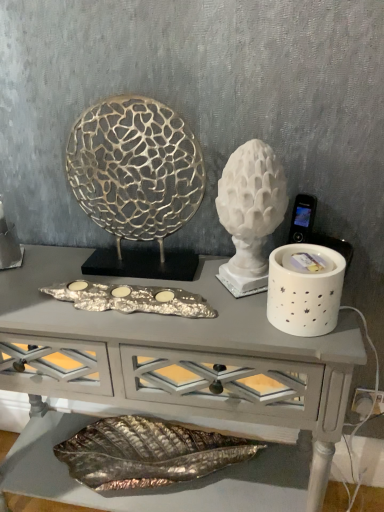
Where is `blank space to the left of gold textured sculpture at center, the 1th sculpture from the left`? The image size is (384, 512). blank space to the left of gold textured sculpture at center, the 1th sculpture from the left is located at coordinates (39, 277).